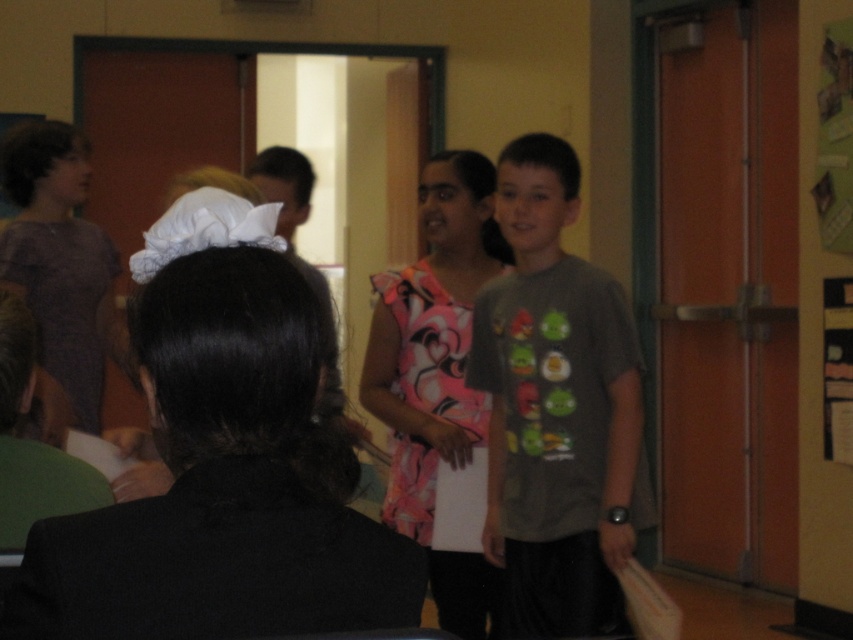
Question: Does dark gray t-shirt at center have a smaller size compared to floral fabric dress at center?

Choices:
 (A) no
 (B) yes

Answer: (B)

Question: Can you confirm if dark gray t-shirt at center is positioned below floral fabric dress at center?

Choices:
 (A) yes
 (B) no

Answer: (A)

Question: Among these objects, which one is farthest from the camera?

Choices:
 (A) floral fabric dress at center
 (B) dark gray t-shirt at center

Answer: (A)

Question: Is dark gray t-shirt at center positioned before floral fabric dress at center?

Choices:
 (A) no
 (B) yes

Answer: (B)